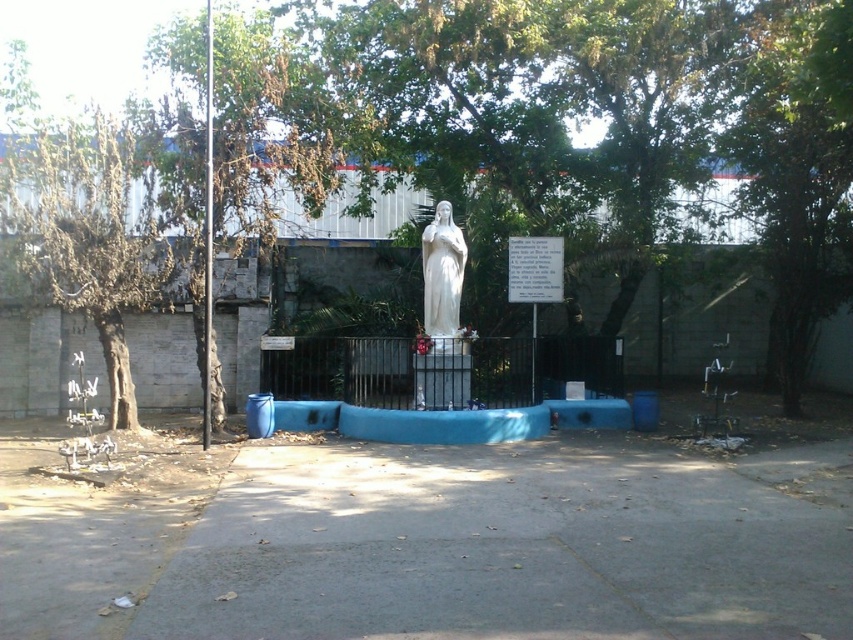
You are standing at point (x=793, y=216) in the scene. What object is located exactly at your current position?

The green leafy tree at center is located exactly at point (x=793, y=216).